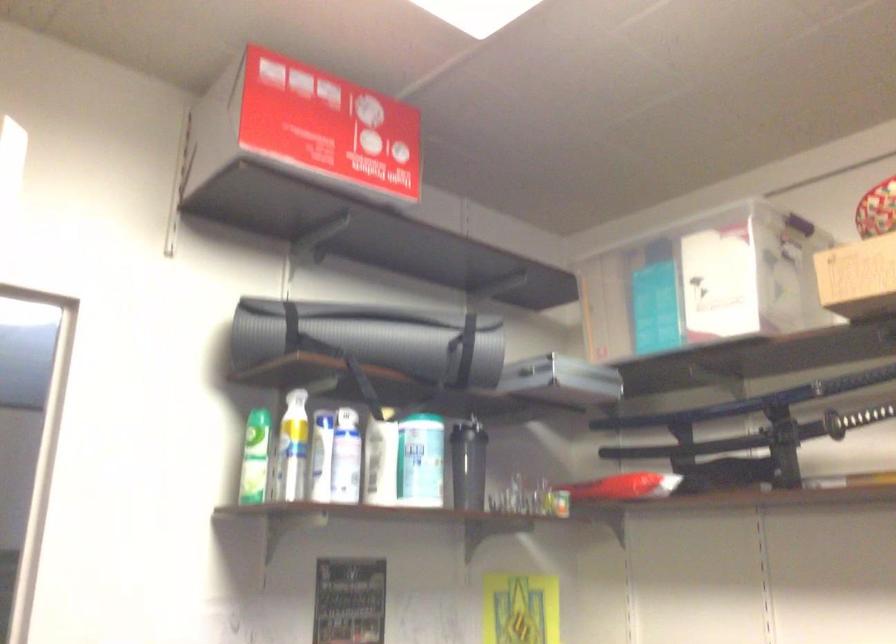
First-person continuous shooting, in which direction is the camera rotating?

The rotation direction of the camera is left-down.